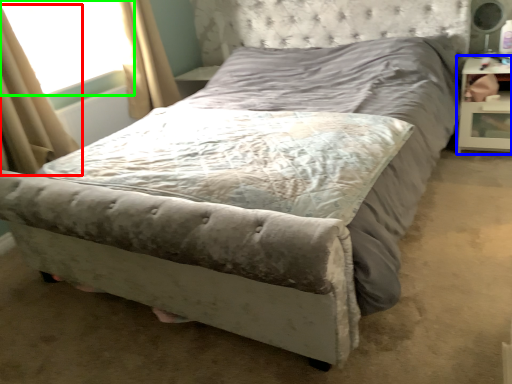
Question: Estimate the real-world distances between objects in this image. Which object is closer to curtain (highlighted by a red box), nightstand (highlighted by a blue box) or window screen (highlighted by a green box)?

Choices:
 (A) nightstand
 (B) window screen

Answer: (B)